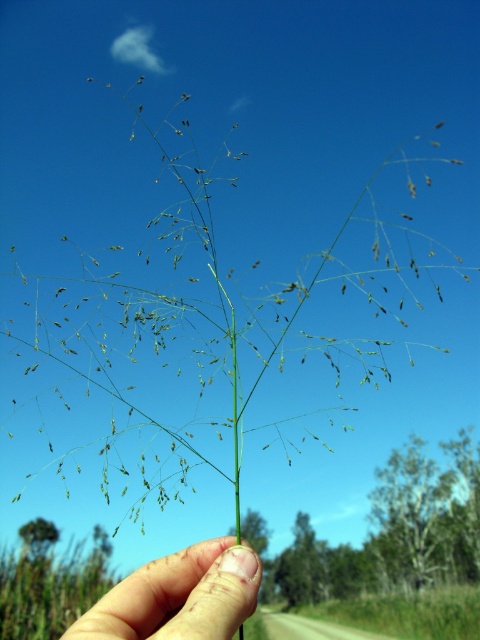
The image size is (480, 640). Describe the element at coordinates (179, 596) in the screenshot. I see `finger nail at center` at that location.

Find the location of a particular element. finger nail at center is located at coordinates (179, 596).